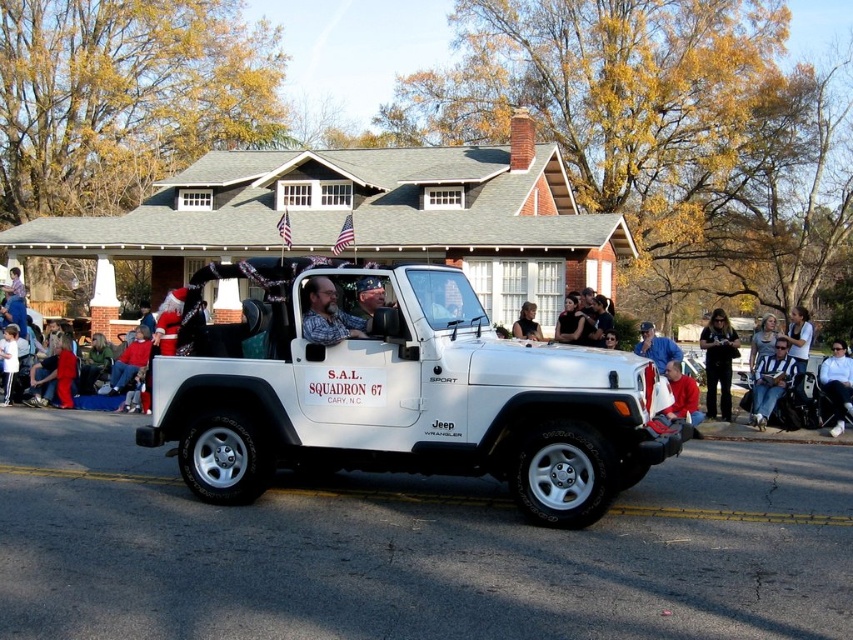
Question: Is matte black camera at lower right below white fabric jacket at lower right?

Choices:
 (A) no
 (B) yes

Answer: (A)

Question: Among these points, which one is nearest to the camera?

Choices:
 (A) (836, 356)
 (B) (651, 356)
 (C) (677, 376)
 (D) (582, 321)

Answer: (C)

Question: Is white fabric jacket at lower right positioned behind matte black shirt at center?

Choices:
 (A) yes
 (B) no

Answer: (B)

Question: Observing the image, what is the correct spatial positioning of white matte jeep wrangler at center in reference to white fabric jacket at lower right?

Choices:
 (A) right
 (B) left

Answer: (B)

Question: Which of the following is the farthest from the observer?

Choices:
 (A) (685, 397)
 (B) (842, 396)
 (C) (775, 364)

Answer: (C)

Question: Considering the real-world distances, which object is farthest from the matte black shirt at center?

Choices:
 (A) blue denim jacket at center
 (B) white fabric jacket at lower right
 (C) red fleece jacket at lower right
 (D) matte black camera at lower right

Answer: (B)